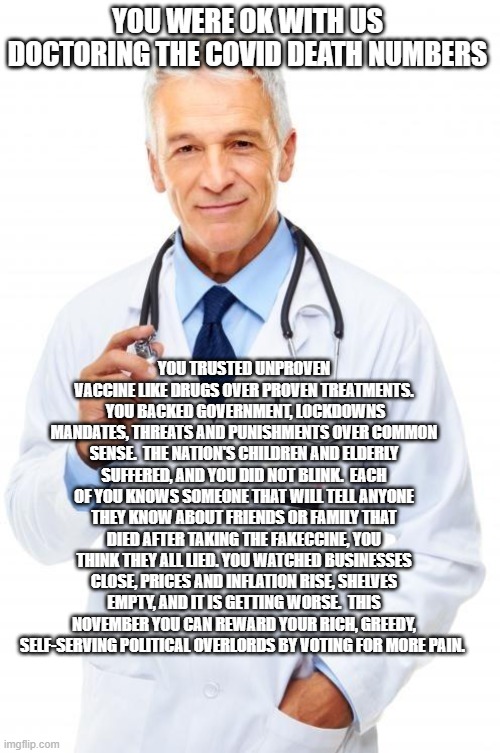
Locate an element on the screen. This screenshot has width=500, height=753. coat is located at coordinates (391, 305).